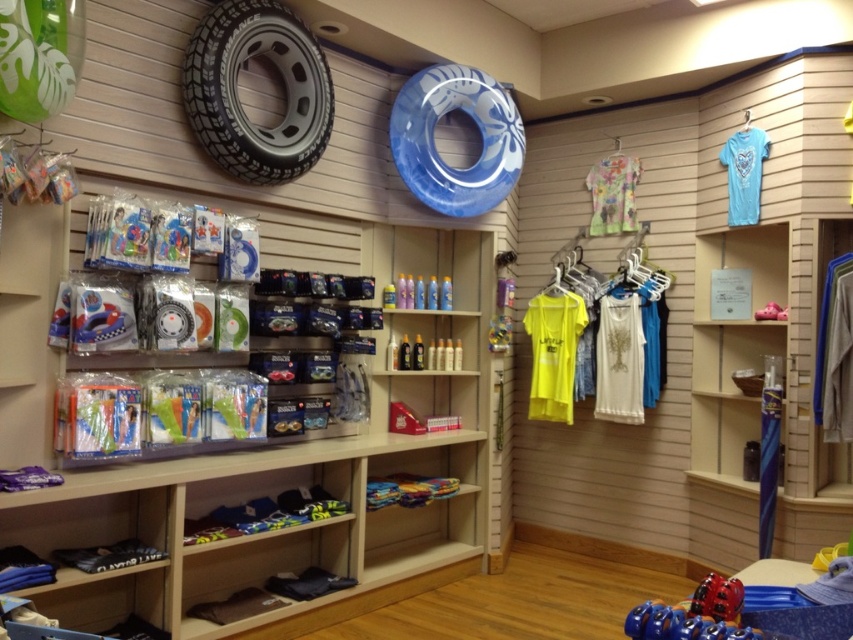
Measure the distance between wooden shelf at center and camera.

wooden shelf at center is 3.55 meters from camera.

Between wooden shelf at center and glossy plastic bottles at center, which one is positioned higher?

glossy plastic bottles at center is higher up.

Is point (473, 547) positioned before point (383, 298)?

No.

I want to click on wooden shelf at center, so click(x=421, y=508).

Which is more to the left, black rubber tire at upper center or glossy plastic bottles at center?

Positioned to the left is black rubber tire at upper center.

Between black rubber tire at upper center and glossy plastic bottles at center, which one is positioned lower?

Positioned lower is glossy plastic bottles at center.

Image resolution: width=853 pixels, height=640 pixels. Identify the location of black rubber tire at upper center. (236, 97).

Is wooden shelf at center taller than light blue jersey at upper right?

Yes, wooden shelf at center is taller than light blue jersey at upper right.

Does wooden shelf at center have a greater width compared to light blue jersey at upper right?

Indeed, wooden shelf at center has a greater width compared to light blue jersey at upper right.

I want to click on wooden shelf at center, so click(x=421, y=508).

Where is `wooden shelf at center`? This screenshot has width=853, height=640. wooden shelf at center is located at coordinates (421, 508).